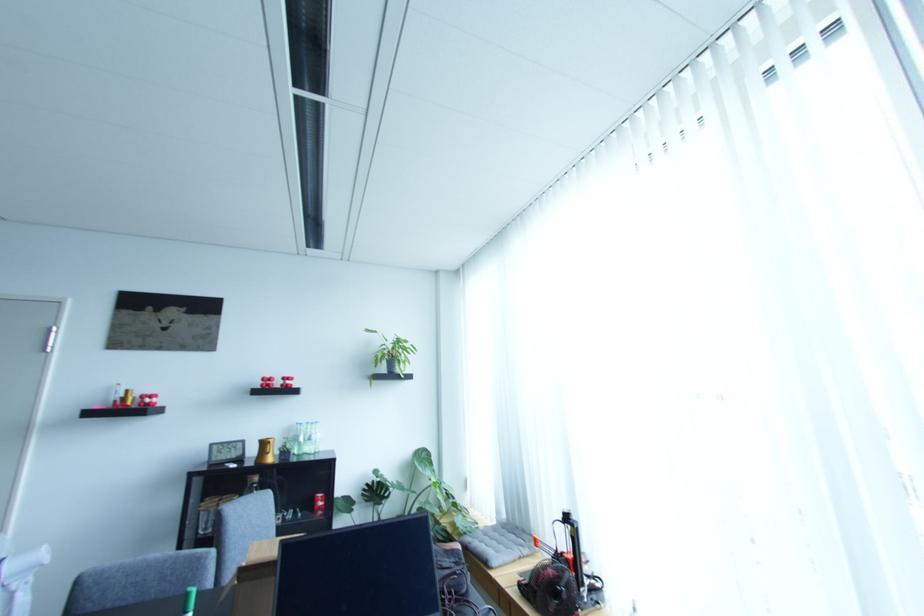
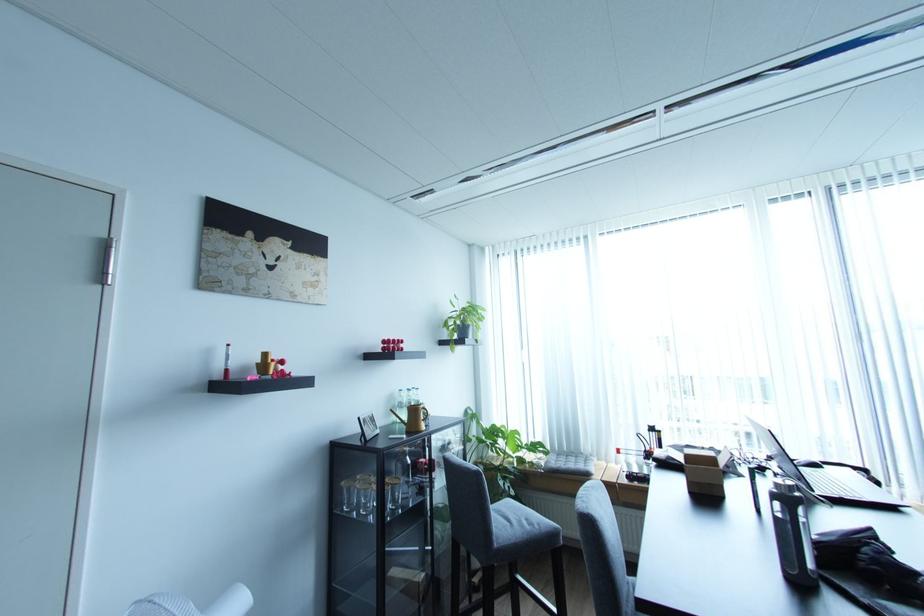
Find the pixel in the second image that matches (x=228, y=496) in the first image.

(361, 477)